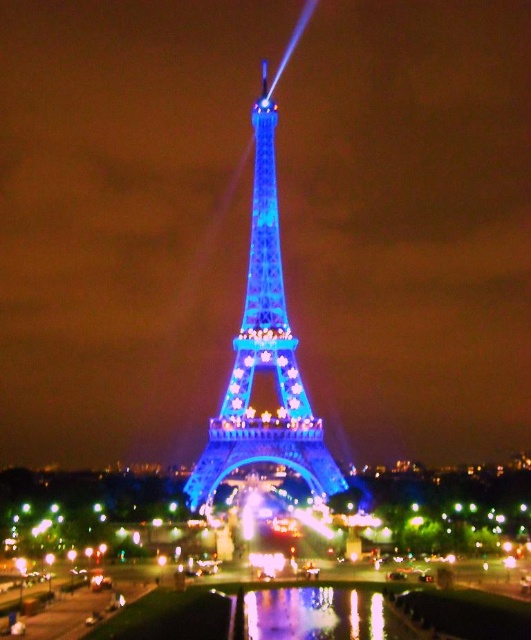
You are standing at point (x=290, y=424) and want to walk towards the Eiffel Tower. Is point (x=286, y=532) in front of or behind you in your path?

Point (x=286, y=532) is behind point (x=290, y=424), so it would be behind you in your path towards the Eiffel Tower.

You are standing on the blue glass bridge at center and want to take a photo of the blue illuminated metal eiffel tower at center. Since the bridge is below the tower, where should you position yourself to capture the entire structure in your shot?

Since the blue glass bridge at center is located below the blue illuminated metal eiffel tower at center, you should position yourself on the blue glass bridge at center and look upward to capture the entire structure of the blue illuminated metal eiffel tower at center in your photo.